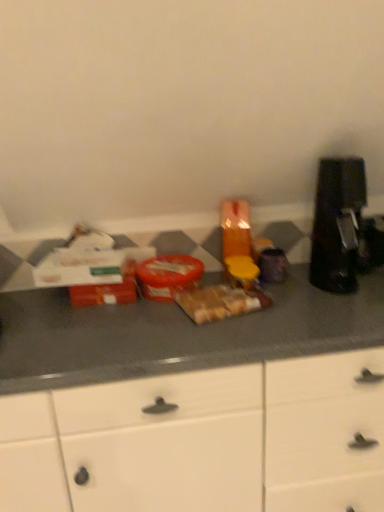
This screenshot has height=512, width=384. In order to click on free space between black plastic coffee machine at right and brown matte sandwich at center, positioned as the 1th food in right-to-left order in this screenshot , I will do `click(289, 291)`.